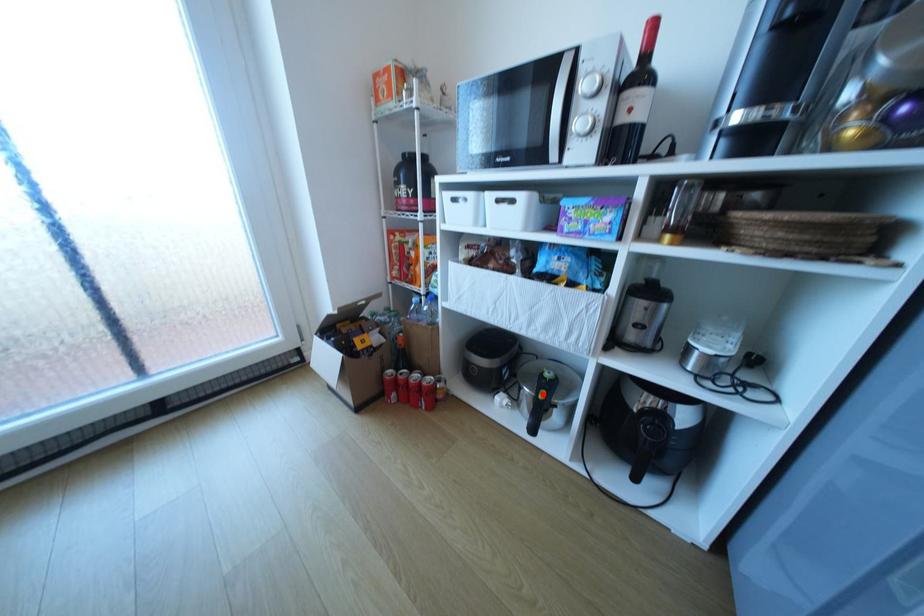
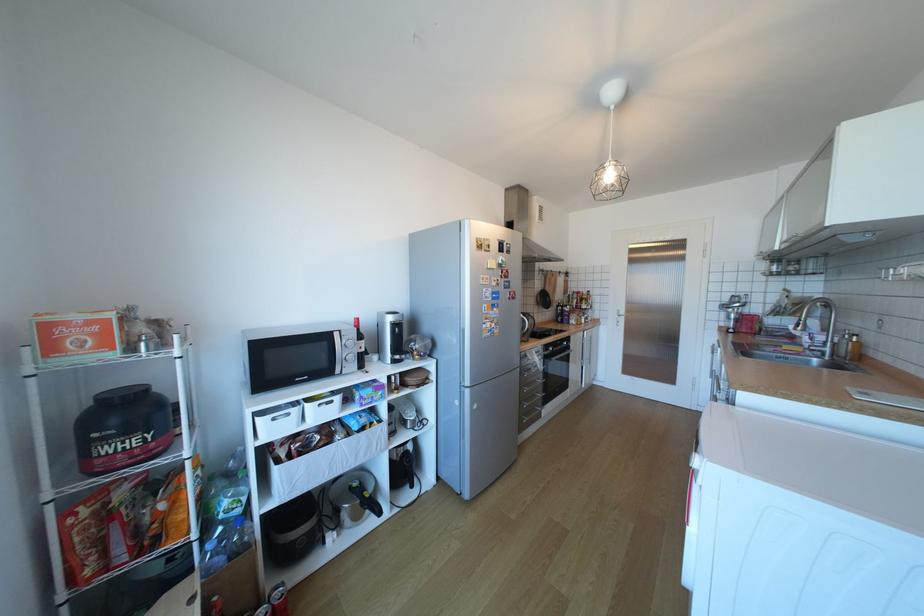
Question: I am providing you with two images of the same scene from different viewpoints. A red point is marked on the first image. At the location where the point appears in image 1, is it still visible in image 2?

Choices:
 (A) Yes
 (B) No

Answer: (A)